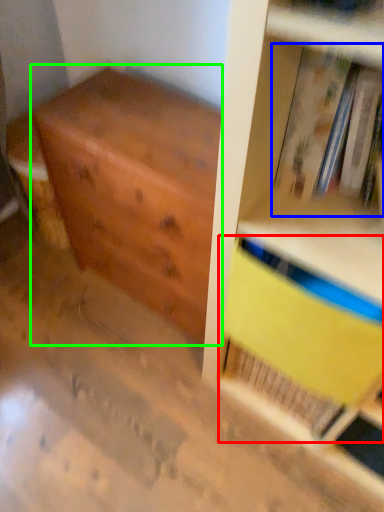
Question: Based on their relative distances, which object is nearer to paperback book (highlighted by a red box)? Choose from book (highlighted by a blue box) and chest of drawers (highlighted by a green box).

Choices:
 (A) book
 (B) chest of drawers

Answer: (A)